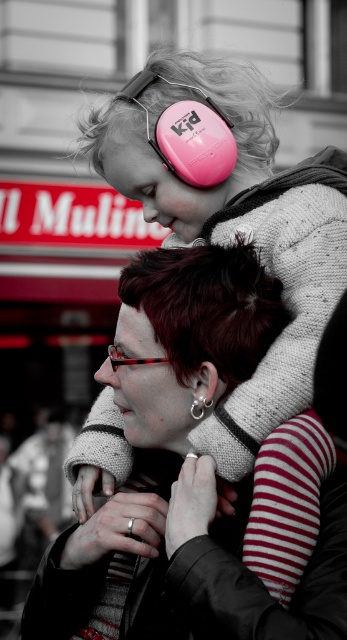
Is point (235, 380) closer to camera compared to point (138, 132)?

Yes.

Can you confirm if matte black jacket at center is positioned above pink matte ear protection at upper center?

No.

This screenshot has width=347, height=640. I want to click on matte black jacket at center, so click(188, 472).

Is point (195, 83) farther from viewer compared to point (109, 355)?

Yes.

Is pink matte ear protection at upper center bigger than translucent red glasses at center?

Correct, pink matte ear protection at upper center is larger in size than translucent red glasses at center.

Between point (141, 148) and point (115, 368), which one is positioned in front?

Point (115, 368) is more forward.

What are the coordinates of `pink matte ear protection at upper center` in the screenshot? It's located at (172, 160).

Does dark red hair at center appear over pink matte ear protection at upper center?

Actually, dark red hair at center is below pink matte ear protection at upper center.

Find the location of a particular element. The image size is (347, 640). dark red hair at center is located at coordinates (188, 337).